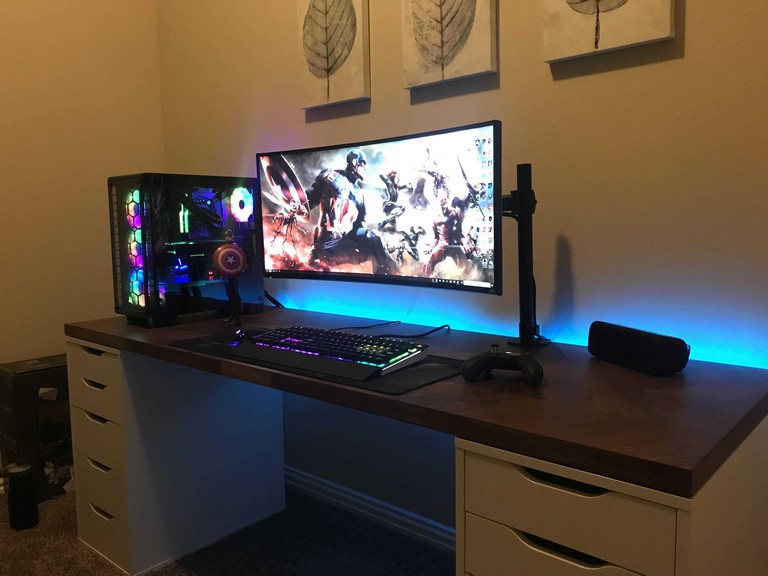
Locate an element on the screen. The image size is (768, 576). drawer on the upper right hand side is located at coordinates (611, 517).